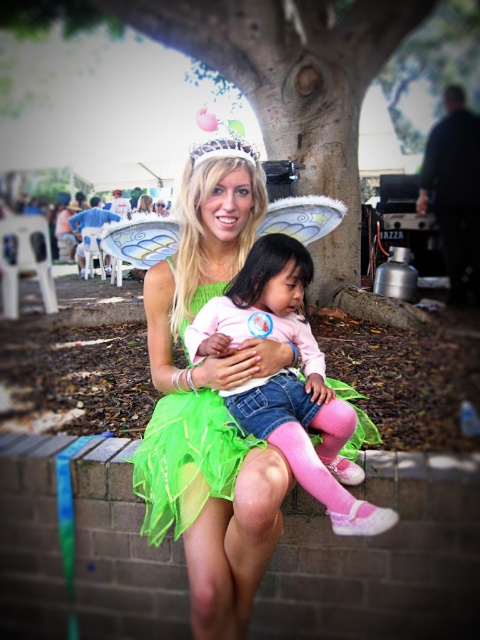
You are taking a photo of the green leafy tree at center and the pink fabric dress at center. Which object is closer to the camera?

The green leafy tree at center is closer to the camera than the pink fabric dress at center.

You are standing in the outdoor fairy scene and want to place a small flower bouquet exactly at the point marked as point (231, 192). Since you are 5 feet tall, will you be able to reach that point without any assistance?

The point (231, 192) is 5.88 feet from the viewer. Since you are 5 feet tall, you will need assistance to reach that point as it is slightly higher than your height.